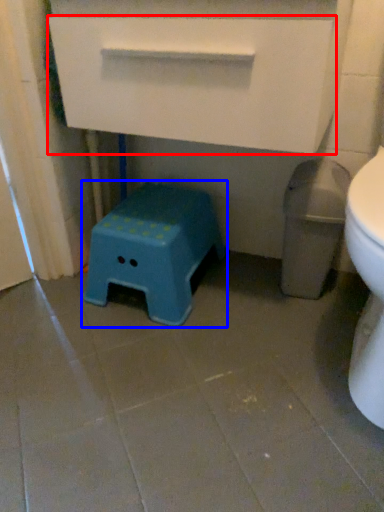
Question: Among these objects, which one is nearest to the camera, drawer (highlighted by a red box) or stool (highlighted by a blue box)?

Choices:
 (A) drawer
 (B) stool

Answer: (A)